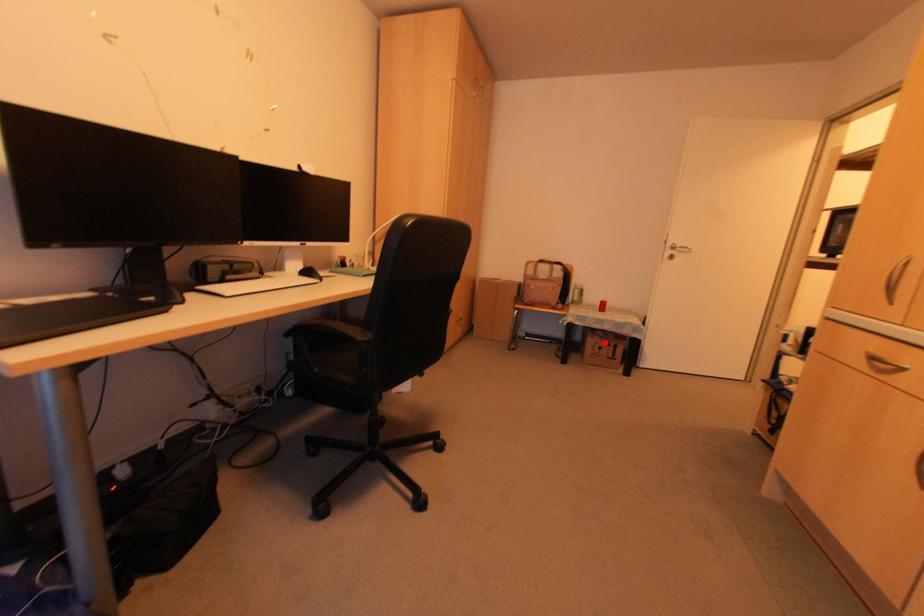
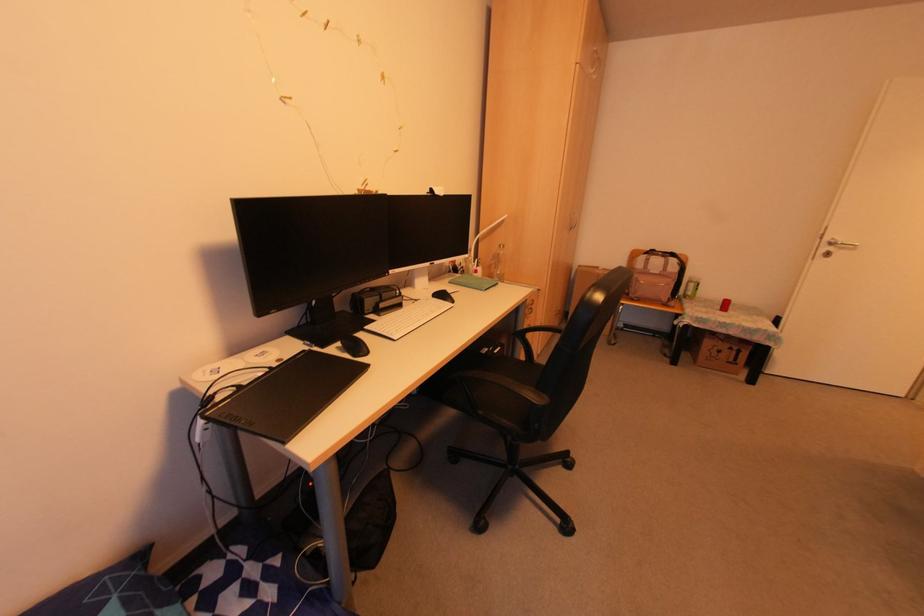
Where in the second image is the point corresponding to the highlighted location from the first image?

(725, 346)